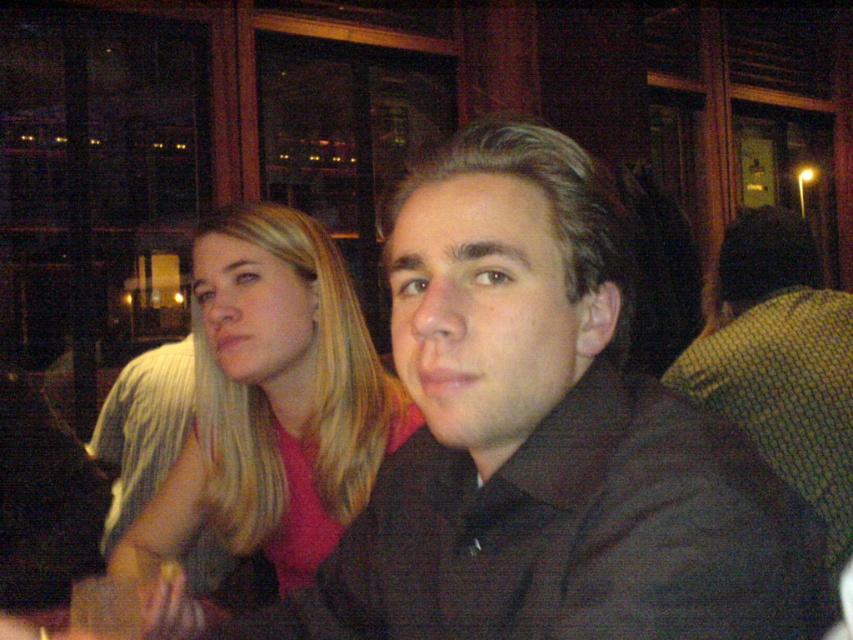
You are a photographer adjusting the lighting in this scene. You need to ensure that both the blonde hair at left and the black matte shirt at center are well lit. Given their heights, which object should you adjust the light closer to the floor for?

The blonde hair at left has a lesser height compared to the black matte shirt at center, so you should adjust the light closer to the floor for the blonde hair at left to ensure proper illumination.